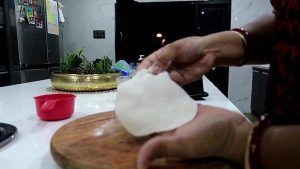
The width and height of the screenshot is (300, 169). In order to click on handle to open drawer in this screenshot , I will do `click(254, 72)`, `click(265, 75)`.